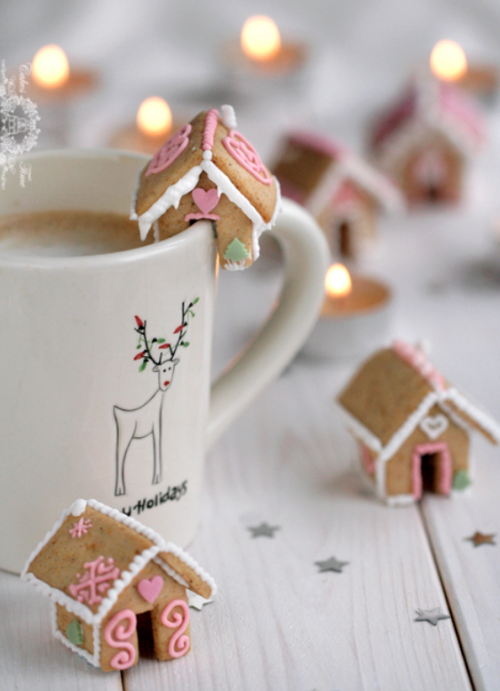
I want to click on 8 drawn decorative christmas lights, so click(x=135, y=318), click(x=135, y=352), click(x=144, y=363), click(x=159, y=337), click(x=166, y=343), click(x=179, y=325), click(x=183, y=346), click(x=194, y=299).